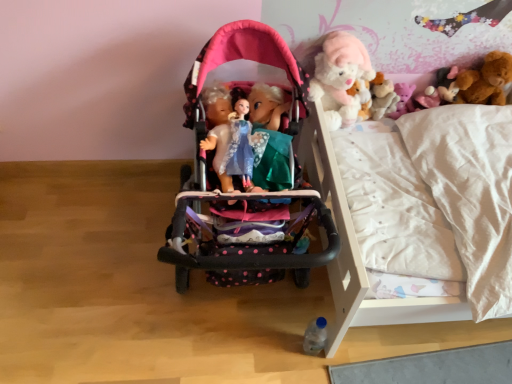
Question: Is white wooden bunk bed at center shorter than fluffy white teddy bear at upper right?

Choices:
 (A) yes
 (B) no

Answer: (B)

Question: Can fluffy white teddy bear at upper right be found inside white wooden bunk bed at center?

Choices:
 (A) no
 (B) yes

Answer: (A)

Question: Can you confirm if white wooden bunk bed at center is smaller than fluffy white teddy bear at upper right?

Choices:
 (A) no
 (B) yes

Answer: (A)

Question: Is white wooden bunk bed at center behind fluffy white teddy bear at upper right?

Choices:
 (A) no
 (B) yes

Answer: (A)

Question: Can you confirm if white wooden bunk bed at center is positioned to the left of fluffy white teddy bear at upper right?

Choices:
 (A) yes
 (B) no

Answer: (A)

Question: Does white wooden bunk bed at center have a greater width compared to fluffy white teddy bear at upper right?

Choices:
 (A) yes
 (B) no

Answer: (A)

Question: From the image's perspective, does fluffy white teddy bear at upper right appear lower than pink plush bear at upper right, which is counted as the third toy, starting from the top?

Choices:
 (A) yes
 (B) no

Answer: (A)

Question: Is fluffy white teddy bear at upper right located outside pink plush bear at upper right, the 2th toy positioned from the bottom?

Choices:
 (A) no
 (B) yes

Answer: (B)

Question: Does fluffy white teddy bear at upper right have a greater height compared to pink plush bear at upper right, arranged as the 2th toy when viewed from the right?

Choices:
 (A) no
 (B) yes

Answer: (B)

Question: From a real-world perspective, is fluffy white teddy bear at upper right under pink plush bear at upper right, the 2th toy positioned from the bottom?

Choices:
 (A) yes
 (B) no

Answer: (B)

Question: Is fluffy white teddy bear at upper right at the left side of pink plush bear at upper right, which is counted as the third toy, starting from the top?

Choices:
 (A) yes
 (B) no

Answer: (A)

Question: Does fluffy white teddy bear at upper right have a smaller size compared to pink plush bear at upper right, arranged as the 2th toy when viewed from the right?

Choices:
 (A) yes
 (B) no

Answer: (B)

Question: Considering the relative sizes of white wooden bunk bed at center and clear plastic bottle at lower center, the first toy positioned from the left, in the image provided, is white wooden bunk bed at center taller than clear plastic bottle at lower center, the first toy positioned from the left,?

Choices:
 (A) no
 (B) yes

Answer: (B)